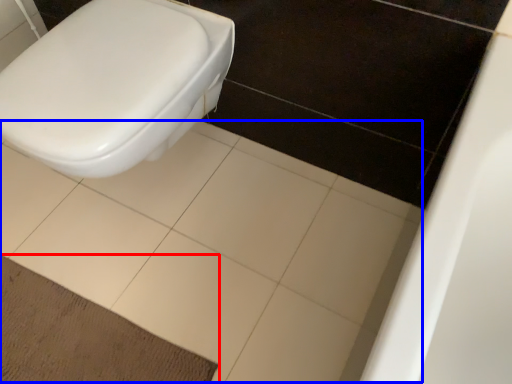
Question: Which object appears closest to the camera in this image, doormat (highlighted by a red box) or ceramic tile (highlighted by a blue box)?

Choices:
 (A) doormat
 (B) ceramic tile

Answer: (B)